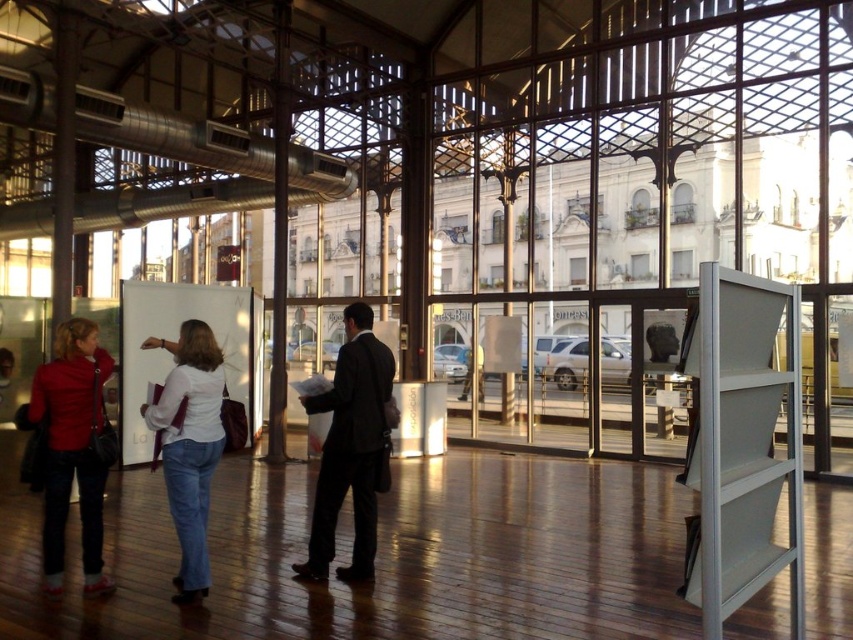
Question: Which of the following is the closest to the observer?

Choices:
 (A) (112, 365)
 (B) (367, 330)
 (C) (172, 461)

Answer: (C)

Question: Considering the relative positions of dark suit at center and matte red jacket at left in the image provided, where is dark suit at center located with respect to matte red jacket at left?

Choices:
 (A) above
 (B) below

Answer: (A)

Question: Which point appears closest to the camera in this image?

Choices:
 (A) (206, 444)
 (B) (357, 477)
 (C) (90, 326)

Answer: (A)

Question: Does matte red jacket at left appear over white matte shirt at center?

Choices:
 (A) yes
 (B) no

Answer: (A)

Question: Can you confirm if dark suit at center is positioned to the left of white matte shirt at center?

Choices:
 (A) no
 (B) yes

Answer: (A)

Question: Among these points, which one is nearest to the camera?

Choices:
 (A) (160, 426)
 (B) (105, 433)
 (C) (358, 422)

Answer: (A)